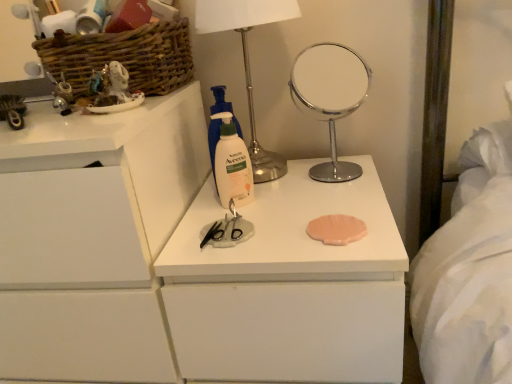
Question: Should I look upward or downward to see woven brown basket at upper left?

Choices:
 (A) up
 (B) down

Answer: (A)

Question: Is woven brown basket at upper left positioned with its back to polished chrome mirror at center?

Choices:
 (A) yes
 (B) no

Answer: (B)

Question: From the image's perspective, is woven brown basket at upper left located beneath polished chrome mirror at center?

Choices:
 (A) no
 (B) yes

Answer: (A)

Question: Would you say woven brown basket at upper left is outside polished chrome mirror at center?

Choices:
 (A) yes
 (B) no

Answer: (A)

Question: From a real-world perspective, is woven brown basket at upper left over polished chrome mirror at center?

Choices:
 (A) no
 (B) yes

Answer: (B)

Question: Considering the relative sizes of woven brown basket at upper left and polished chrome mirror at center in the image provided, is woven brown basket at upper left taller than polished chrome mirror at center?

Choices:
 (A) yes
 (B) no

Answer: (B)

Question: From a real-world perspective, is woven brown basket at upper left under polished chrome mirror at center?

Choices:
 (A) yes
 (B) no

Answer: (B)

Question: Is metallic silver table lamp at upper center positioned in front of matte white figurine at upper left?

Choices:
 (A) no
 (B) yes

Answer: (A)

Question: From the image's perspective, is metallic silver table lamp at upper center above matte white figurine at upper left?

Choices:
 (A) yes
 (B) no

Answer: (A)

Question: Considering the relative positions of metallic silver table lamp at upper center and matte white figurine at upper left in the image provided, is metallic silver table lamp at upper center to the right of matte white figurine at upper left from the viewer's perspective?

Choices:
 (A) yes
 (B) no

Answer: (A)

Question: Can you confirm if metallic silver table lamp at upper center is positioned to the left of matte white figurine at upper left?

Choices:
 (A) no
 (B) yes

Answer: (A)

Question: Considering the relative sizes of metallic silver table lamp at upper center and matte white figurine at upper left in the image provided, is metallic silver table lamp at upper center smaller than matte white figurine at upper left?

Choices:
 (A) no
 (B) yes

Answer: (A)

Question: From a real-world perspective, is metallic silver table lamp at upper center positioned over matte white figurine at upper left based on gravity?

Choices:
 (A) yes
 (B) no

Answer: (B)

Question: Is white matte chest of drawers at center, which ranks as the 1th chest of drawers in right-to-left order, a part of polished chrome mirror at center?

Choices:
 (A) no
 (B) yes

Answer: (A)